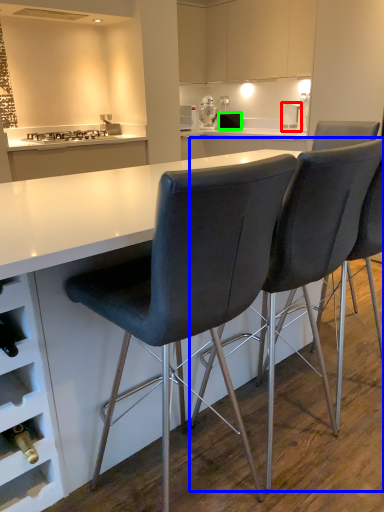
Question: Which object is positioned closest to kitchen appliance (highlighted by a red box)? Select from chair (highlighted by a blue box) and appliance (highlighted by a green box).

Choices:
 (A) chair
 (B) appliance

Answer: (B)